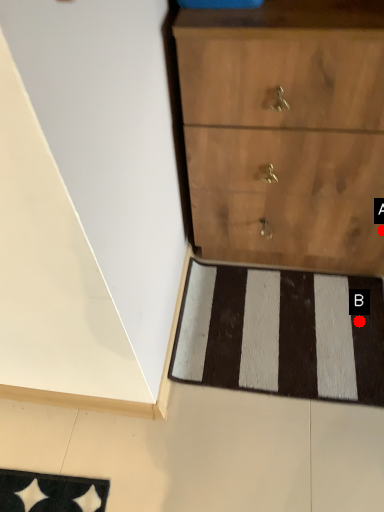
Question: Two points are circled on the image, labeled by A and B beside each circle. Among these points, which one is nearest to the camera?

Choices:
 (A) A is closer
 (B) B is closer

Answer: (A)